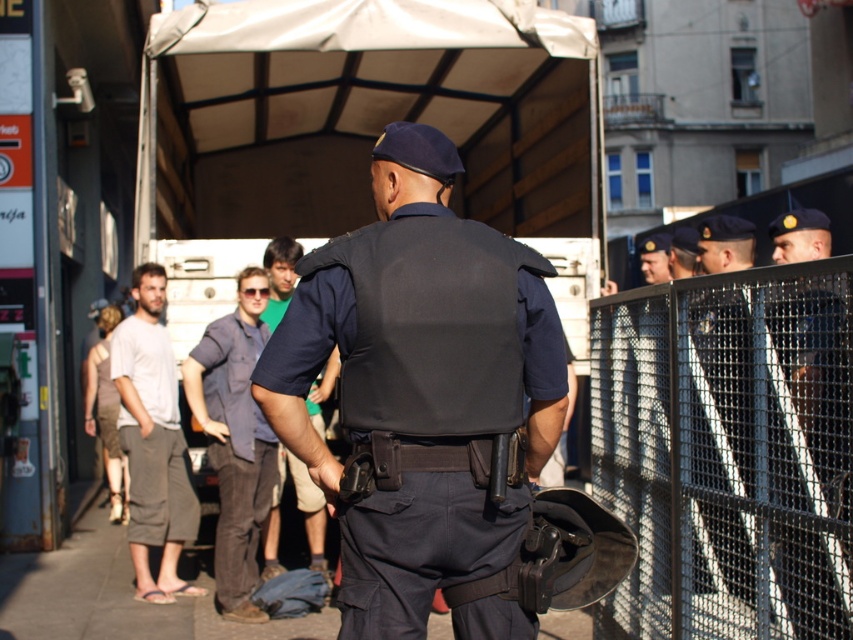
You are a fashion designer analyzing clothing layers in the image. You notice the dark blue denim pants at center and the dark blue shirt at center. Which clothing item is visible on top?

The dark blue denim pants at center are positioned over the dark blue shirt at center, making them the visible top layer.

You are a passerby in the scene and need to identify which clothing item belongs to the police officer. Based on the description provided, which one is bigger in size between the navy blue uniform at center and the dark blue shirt at center?

The navy blue uniform at center is larger in size than the dark blue shirt at center, so the navy blue uniform at center belongs to the police officer.

You are a delivery person trying to determine the best path to deliver a package. You see the metallic mesh fence at right and the gray cotton shorts at left. Which object is larger in size?

The metallic mesh fence at right is bigger than the gray cotton shorts at left, so the metallic mesh fence at right is larger in size.